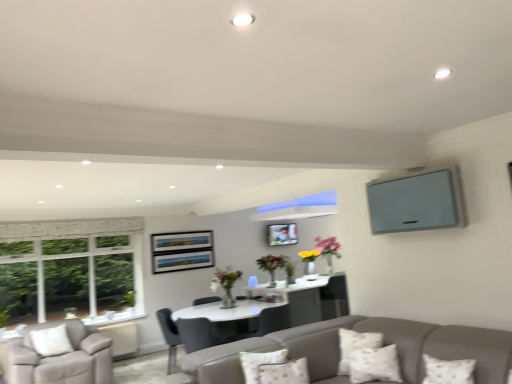
Question: Is white textured pillow at lower center, which is the third pillow from left to right, oriented away from matte gray chair at center, arranged as the 2th chair when viewed from the left?

Choices:
 (A) yes
 (B) no

Answer: (B)

Question: Could you tell me if white textured pillow at lower center, which is the third pillow from left to right, is facing matte gray chair at center, arranged as the 2th chair when viewed from the left?

Choices:
 (A) no
 (B) yes

Answer: (A)

Question: Is white textured pillow at lower center, the 1th pillow positioned from the right, completely or partially outside of matte gray chair at center, the 1th chair from the right?

Choices:
 (A) no
 (B) yes

Answer: (B)

Question: From the image's perspective, is white textured pillow at lower center, which is the third pillow from left to right, beneath matte gray chair at center, the 1th chair from the right?

Choices:
 (A) yes
 (B) no

Answer: (B)

Question: Is matte gray chair at center, arranged as the 2th chair when viewed from the left, surrounded by white textured pillow at lower center, the 1th pillow positioned from the right?

Choices:
 (A) no
 (B) yes

Answer: (A)

Question: Can you confirm if white textured pillow at lower center, which is the third pillow from left to right, is positioned to the left of matte gray chair at center, arranged as the 2th chair when viewed from the left?

Choices:
 (A) yes
 (B) no

Answer: (B)

Question: From the image's perspective, is fluffy white pillow at lower center, placed as the third pillow when sorted from right to left, over light gray fabric armchair at lower left, the 2th chair in the right-to-left sequence?

Choices:
 (A) no
 (B) yes

Answer: (B)

Question: From the image's perspective, would you say fluffy white pillow at lower center, which is counted as the first pillow, starting from the left, is shown under light gray fabric armchair at lower left, the 1th chair from the left?

Choices:
 (A) yes
 (B) no

Answer: (B)

Question: Can you confirm if fluffy white pillow at lower center, which is counted as the first pillow, starting from the left, is taller than light gray fabric armchair at lower left, the 2th chair in the right-to-left sequence?

Choices:
 (A) no
 (B) yes

Answer: (A)

Question: Is fluffy white pillow at lower center, which is counted as the first pillow, starting from the left, far from light gray fabric armchair at lower left, the 2th chair in the right-to-left sequence?

Choices:
 (A) yes
 (B) no

Answer: (A)

Question: Is fluffy white pillow at lower center, which is counted as the first pillow, starting from the left, at the right side of light gray fabric armchair at lower left, the 2th chair in the right-to-left sequence?

Choices:
 (A) yes
 (B) no

Answer: (A)

Question: Considering the relative sizes of fluffy white pillow at lower center, which is counted as the first pillow, starting from the left, and light gray fabric armchair at lower left, the 2th chair in the right-to-left sequence, in the image provided, is fluffy white pillow at lower center, which is counted as the first pillow, starting from the left, thinner than light gray fabric armchair at lower left, the 2th chair in the right-to-left sequence,?

Choices:
 (A) no
 (B) yes

Answer: (A)

Question: Are matte gray tv at upper right and fluffy white pillow at lower center, which is counted as the first pillow, starting from the left, beside each other?

Choices:
 (A) yes
 (B) no

Answer: (B)